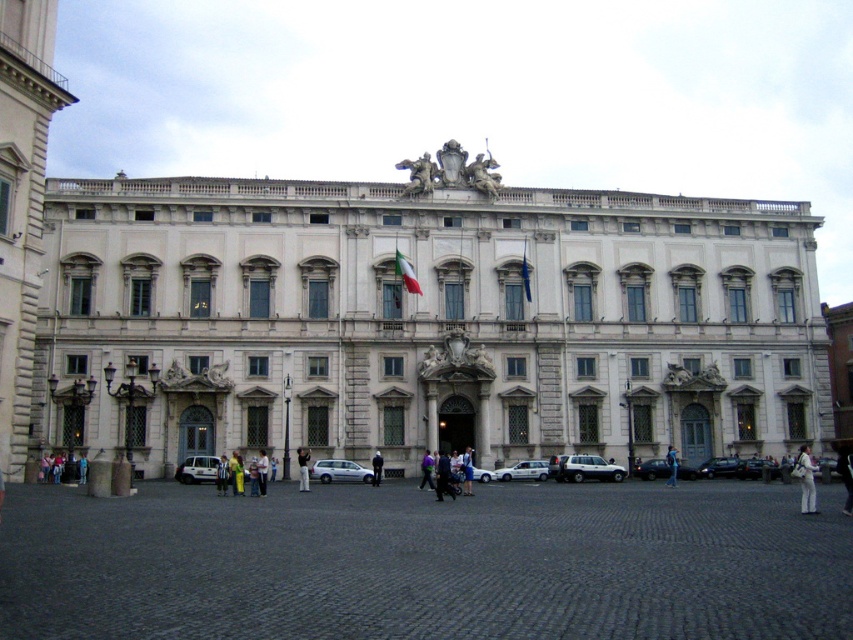
You are standing in front of the classical building and see a yellow fabric bag at lower center and a purple fabric at center. Which one is positioned more to the left side?

The yellow fabric bag at lower center is positioned more to the left side than the purple fabric at center.

From the picture: You are a photographer standing in the public square. You want to take a picture of the white marble building at left and the white matte van at lower left. Based on their positions, which one will appear larger in the photo?

The white marble building at left is above the white matte van at lower left, so the van will appear larger in the photo because it is closer to the camera.

You are a photographer trying to capture the white marble building at left and the white matte van at lower left in a single shot. Based on their positions, will the van be partially or fully visible in the photo if you focus on the building?

The white marble building at left is in front of the white matte van at lower left, so if you focus on the building, the van will be partially visible behind it.